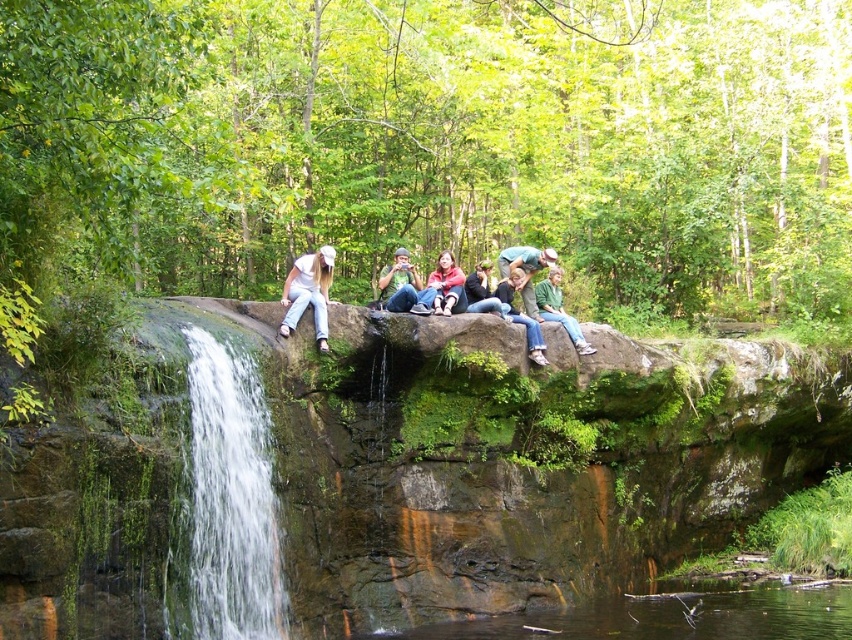
You are part of a hiking group and want to take a photo of the matte blue jeans at center and the matte pink sweater at center. Which one should you focus on first to ensure both are in the frame?

You should focus on the matte blue jeans at center first since it is closer to you than the matte pink sweater at center, ensuring both are in the frame.